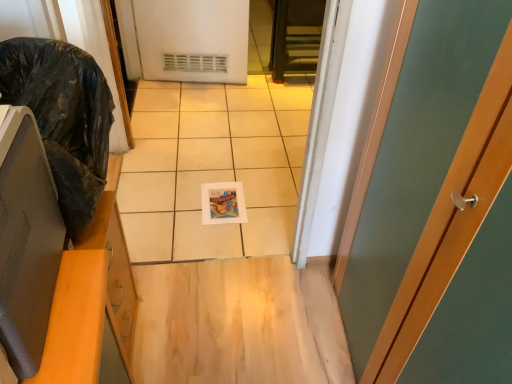
Measure the distance between black plastic bag at left and camera.

black plastic bag at left and camera are 30.67 inches apart.

This screenshot has width=512, height=384. What do you see at coordinates (63, 117) in the screenshot?
I see `black plastic bag at left` at bounding box center [63, 117].

In order to click on black plastic bag at left in this screenshot , I will do (x=63, y=117).

Describe the element at coordinates (26, 241) in the screenshot. I see `matte black monitor at left` at that location.

Identify the location of matte black monitor at left. The height and width of the screenshot is (384, 512). (26, 241).

Locate an element on the screen. black plastic bag at left is located at coordinates (63, 117).

Visually, is matte black monitor at left positioned to the left or to the right of black plastic bag at left?

Clearly, matte black monitor at left is on the right of black plastic bag at left in the image.

Considering the positions of objects matte black monitor at left and black plastic bag at left in the image provided, who is in front, matte black monitor at left or black plastic bag at left?

matte black monitor at left is in front.

Which point is more distant from viewer, (5, 150) or (72, 151)?

Positioned behind is point (72, 151).

From the image's perspective, does matte black monitor at left appear higher than black plastic bag at left?

Incorrect, from the image's perspective, matte black monitor at left is lower than black plastic bag at left.

Consider the image. From a real-world perspective, is matte black monitor at left positioned above or below black plastic bag at left?

matte black monitor at left is above black plastic bag at left.

Which of these two, matte black monitor at left or black plastic bag at left, is wider?

Wider between the two is black plastic bag at left.

Considering the sizes of objects matte black monitor at left and black plastic bag at left in the image provided, who is shorter, matte black monitor at left or black plastic bag at left?

Standing shorter between the two is matte black monitor at left.

Considering the relative sizes of matte black monitor at left and black plastic bag at left in the image provided, is matte black monitor at left smaller than black plastic bag at left?

Indeed, matte black monitor at left has a smaller size compared to black plastic bag at left.

Is matte black monitor at left completely or partially outside of black plastic bag at left?

Yes, matte black monitor at left is located beyond the bounds of black plastic bag at left.

Is matte black monitor at left far away from black plastic bag at left?

No.

Is matte black monitor at left positioned with its back to black plastic bag at left?

No, black plastic bag at left is not at the back of matte black monitor at left.

What's the angular difference between matte black monitor at left and black plastic bag at left's facing directions?

3.17 degrees separate the facing orientations of matte black monitor at left and black plastic bag at left.

The width and height of the screenshot is (512, 384). I want to click on garbage that appears below the matte black monitor at left (from a real-world perspective), so click(63, 117).

Is black plastic bag at left to the right of matte black monitor at left from the viewer's perspective?

No.

Considering their positions, is black plastic bag at left located in front of or behind matte black monitor at left?

In the image, black plastic bag at left appears behind matte black monitor at left.

Does point (97, 90) lie behind point (48, 264)?

Yes, it is behind point (48, 264).

From the image's perspective, is black plastic bag at left above or below matte black monitor at left?

black plastic bag at left is above matte black monitor at left.

From a real-world perspective, is black plastic bag at left on matte black monitor at left?

No, from a real-world perspective, black plastic bag at left is not over matte black monitor at left

Is black plastic bag at left thinner than matte black monitor at left?

No.

Does black plastic bag at left have a lesser height compared to matte black monitor at left?

No, black plastic bag at left is not shorter than matte black monitor at left.

Is black plastic bag at left bigger than matte black monitor at left?

Correct, black plastic bag at left is larger in size than matte black monitor at left.

Is black plastic bag at left not within matte black monitor at left?

Yes.

Is black plastic bag at left positioned far away from matte black monitor at left?

That's not correct — black plastic bag at left is a little close to matte black monitor at left.

Is black plastic bag at left facing away from matte black monitor at left?

No, black plastic bag at left's orientation is not away from matte black monitor at left.

Measure the distance between black plastic bag at left and matte black monitor at left.

black plastic bag at left is 9.97 inches from matte black monitor at left.

Find the location of `computer monitor positioned vertically above the black plastic bag at left (from a real-world perspective)`. computer monitor positioned vertically above the black plastic bag at left (from a real-world perspective) is located at coordinates (26, 241).

Find the location of a particular element. The height and width of the screenshot is (384, 512). garbage lying behind the matte black monitor at left is located at coordinates (63, 117).

Identify the location of garbage on the left of matte black monitor at left. (63, 117).